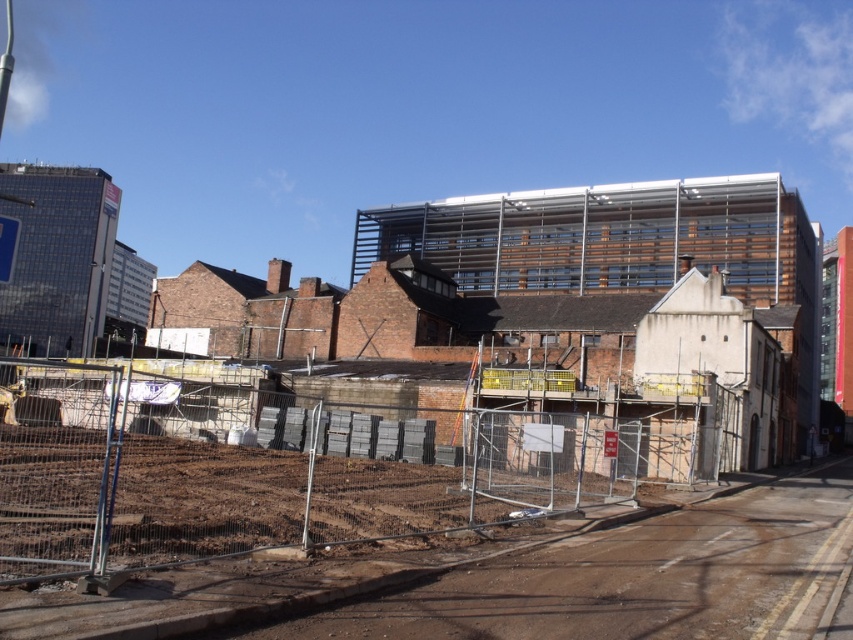
You are a delivery truck driver who needs to navigate through the construction site shown in the image. You see the metal scaffolding at center and the brown dirt track at lower left. Which object is taller, and how might this affect your route planning?

The metal scaffolding at center is much taller than the brown dirt track at lower left. Since the scaffolding is taller, you should plan your route to avoid hitting it, possibly by taking a lower path or adjusting your height if possible.

You are a delivery truck driver who needs to navigate through the construction site shown. You see the metal scaffolding at center and the brown dirt track at lower left. Can you determine if your truck, which is 2 meters wide, can pass through the space between them?

The metal scaffolding at center might be wider than brown dirt track at lower left. Since the truck is 2 meters wide, it depends on the actual width of the track. If the dirt track is narrower than 2 meters, the truck cannot pass. However, without exact measurements, it is uncertain.

You are a delivery truck driver arriving at the construction site. You need to reach the metal scaffolding at center to deliver materials. However, you notice the brown dirt track at lower left. Based on the scene description, can you determine if the dirt track is a viable path to reach the scaffolding?

The brown dirt track at lower left is behind the metal scaffolding at center, meaning the track is positioned further back relative to the scaffolding. This suggests the dirt track might not be a direct or accessible path to reach the scaffolding. Consider alternative routes or consult site plans for the correct delivery path.